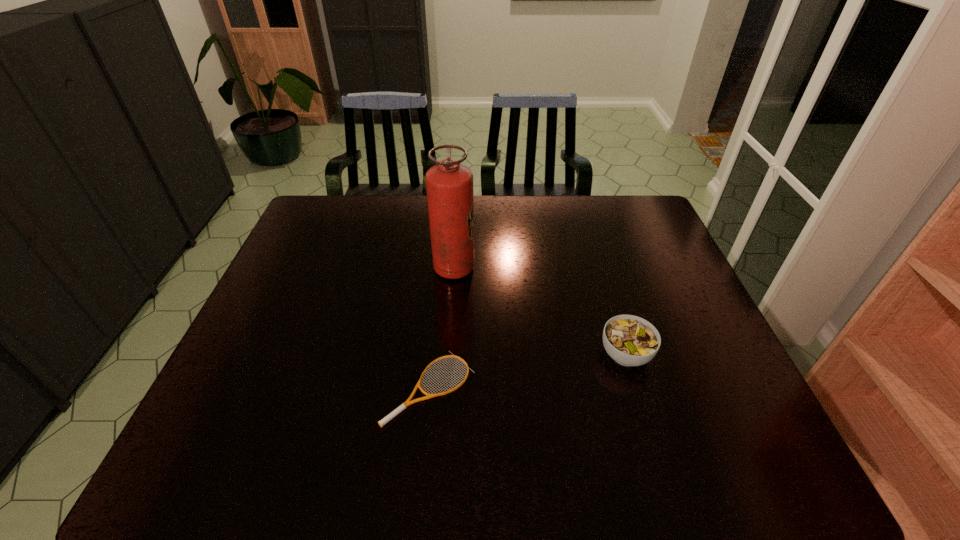
You are a GUI agent. You are given a task and a screenshot of the screen. Output one action in this format:
    pyautogui.click(x=<x>, y=<y>)
    Task: Click on the vacant space that satisfies the following two spatial constraints: 1. on the label side of the farthest object; 2. on the left side of the rightmost object
    
    Given the screenshot: What is the action you would take?
    pyautogui.click(x=448, y=354)

The image size is (960, 540). I want to click on vacant space that satisfies the following two spatial constraints: 1. on the back side of the rightmost object; 2. on the label side of the fire extinguisher, so click(599, 268).